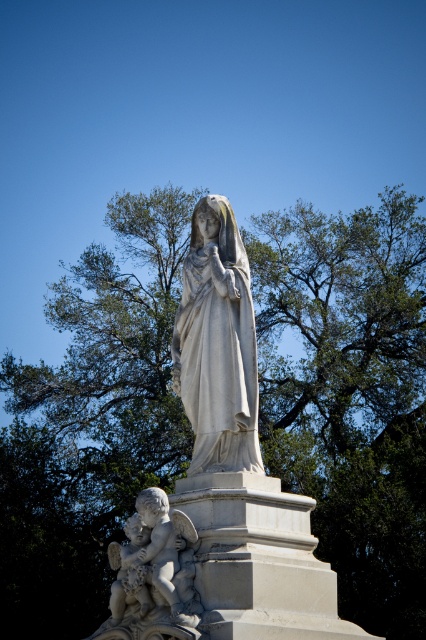
Does point (172, 547) lie behind point (120, 584)?

That is False.

Which is behind, point (146, 608) or point (121, 570)?

The point (121, 570) is behind.

Where is `white marble cherub at lower left`? The height and width of the screenshot is (640, 426). white marble cherub at lower left is located at coordinates (154, 573).

Does green leafy tree at upper center appear on the right side of white marble statue at center?

Indeed, green leafy tree at upper center is positioned on the right side of white marble statue at center.

Is green leafy tree at upper center wider than white marble statue at center?

Correct, the width of green leafy tree at upper center exceeds that of white marble statue at center.

Describe the element at coordinates (350, 392) in the screenshot. I see `green leafy tree at upper center` at that location.

Where is `green leafy tree at upper center`? The image size is (426, 640). green leafy tree at upper center is located at coordinates click(350, 392).

Does green leafy tree at upper center appear under smooth stone cherub at lower left?

Actually, green leafy tree at upper center is above smooth stone cherub at lower left.

Does point (69, 593) come farther from viewer compared to point (135, 557)?

Yes, it is.

Which is in front, point (183, 472) or point (114, 604)?

Point (114, 604) is in front.

Where is `green leafy tree at upper center`? The image size is (426, 640). green leafy tree at upper center is located at coordinates (350, 392).